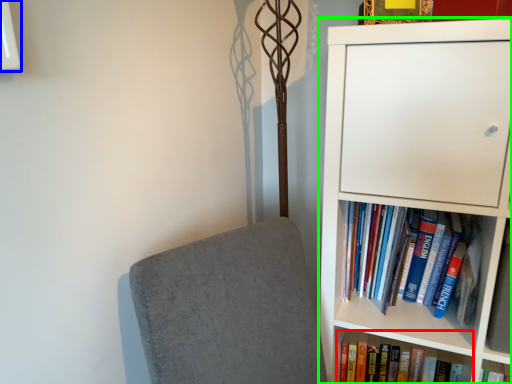
Question: Based on their relative distances, which object is farther from book (highlighted by a red box)? Choose from window (highlighted by a blue box) and bookcase (highlighted by a green box).

Choices:
 (A) window
 (B) bookcase

Answer: (A)